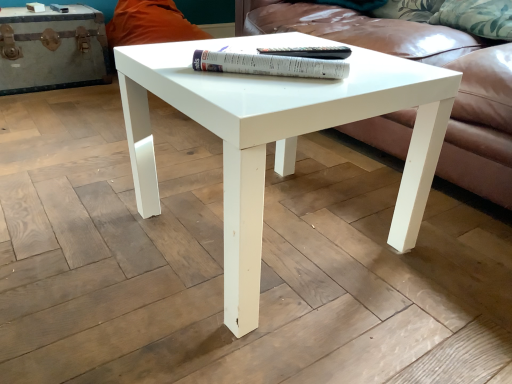
The width and height of the screenshot is (512, 384). Find the location of `white paper at center, the second paperback book when ordered from back to front`. white paper at center, the second paperback book when ordered from back to front is located at coordinates (269, 64).

Describe the element at coordinates (277, 135) in the screenshot. I see `white glossy coffee table at center` at that location.

Looking at this image, how much space does paperback book at center, placed as the 2th paperback book when sorted from front to back, occupy horizontally?

8.45 inches.

Where is `white paper at center, the second paperback book when ordered from back to front`? white paper at center, the second paperback book when ordered from back to front is located at coordinates (269, 64).

In the scene shown: From the image's perspective, is white glossy coffee table at center above or below white paper at center, which ranks as the 1th paperback book in front-to-back order?

white glossy coffee table at center is situated lower than white paper at center, which ranks as the 1th paperback book in front-to-back order, in the image.

The height and width of the screenshot is (384, 512). I want to click on coffee table lying on the left of white paper at center, which ranks as the 1th paperback book in front-to-back order, so click(277, 135).

Does white glossy coffee table at center appear on the left side of white paper at center, which ranks as the 1th paperback book in front-to-back order?

Indeed, white glossy coffee table at center is positioned on the left side of white paper at center, which ranks as the 1th paperback book in front-to-back order.

Considering the sizes of objects white paper at center, which ranks as the 1th paperback book in front-to-back order, and paperback book at center, placed as the 2th paperback book when sorted from front to back, in the image provided, who is taller, white paper at center, which ranks as the 1th paperback book in front-to-back order, or paperback book at center, placed as the 2th paperback book when sorted from front to back,?

white paper at center, which ranks as the 1th paperback book in front-to-back order.

From a real-world perspective, who is located lower, white paper at center, the second paperback book when ordered from back to front, or paperback book at center, placed as the 2th paperback book when sorted from front to back?

In real-world perspective, paperback book at center, placed as the 2th paperback book when sorted from front to back, is lower.

Are white paper at center, which ranks as the 1th paperback book in front-to-back order, and paperback book at center, placed as the 2th paperback book when sorted from front to back, far apart?

white paper at center, which ranks as the 1th paperback book in front-to-back order, is near paperback book at center, placed as the 2th paperback book when sorted from front to back, not far away.

Which is behind, white paper at center, the second paperback book when ordered from back to front, or white leather chest at left?

white leather chest at left is further away from the camera.

Is white paper at center, which ranks as the 1th paperback book in front-to-back order, not within white leather chest at left?

Yes, white paper at center, which ranks as the 1th paperback book in front-to-back order, is not within white leather chest at left.

From the image's perspective, which is below, white paper at center, which ranks as the 1th paperback book in front-to-back order, or white leather chest at left?

white paper at center, which ranks as the 1th paperback book in front-to-back order, from the image's perspective.

Considering the sizes of objects white paper at center, the second paperback book when ordered from back to front, and white leather chest at left in the image provided, who is shorter, white paper at center, the second paperback book when ordered from back to front, or white leather chest at left?

white paper at center, the second paperback book when ordered from back to front, is shorter.

Is white paper at center, which ranks as the 1th paperback book in front-to-back order, not near leather couch at center?

No, white paper at center, which ranks as the 1th paperback book in front-to-back order, is in close proximity to leather couch at center.

From a real-world perspective, who is located higher, white paper at center, which ranks as the 1th paperback book in front-to-back order, or leather couch at center?

From a 3D spatial view, white paper at center, which ranks as the 1th paperback book in front-to-back order, is above.

Looking at this image, is white paper at center, which ranks as the 1th paperback book in front-to-back order, bigger or smaller than leather couch at center?

Considering their sizes, white paper at center, which ranks as the 1th paperback book in front-to-back order, takes up less space than leather couch at center.

Which object is thinner, white paper at center, the second paperback book when ordered from back to front, or leather couch at center?

white paper at center, the second paperback book when ordered from back to front.

Can you confirm if leather couch at center is smaller than white leather chest at left?

Actually, leather couch at center might be larger than white leather chest at left.

Is leather couch at center positioned beyond the bounds of white leather chest at left?

Absolutely, leather couch at center is external to white leather chest at left.

From a real-world perspective, which object stands above the other?

leather couch at center, from a real-world perspective.

Can you tell me how much leather couch at center and white glossy coffee table at center differ in facing direction?

The angular difference between leather couch at center and white glossy coffee table at center is 88.9 degrees.

Is leather couch at center at the left side of white glossy coffee table at center?

Incorrect, leather couch at center is not on the left side of white glossy coffee table at center.

From a real-world perspective, who is located higher, leather couch at center or white glossy coffee table at center?

leather couch at center.

Is white leather chest at left facing towards paperback book at center, placed as the 2th paperback book when sorted from front to back?

Yes, white leather chest at left is oriented towards paperback book at center, placed as the 2th paperback book when sorted from front to back.

From the picture: Is white leather chest at left positioned beyond the bounds of paperback book at center, placed as the 2th paperback book when sorted from front to back?

Yes, white leather chest at left is not within paperback book at center, placed as the 2th paperback book when sorted from front to back.

From a real-world perspective, which object rests below the other?

white leather chest at left, from a real-world perspective.

Considering the sizes of objects white leather chest at left and paperback book at center, which ranks as the first paperback book in back-to-front order, in the image provided, who is shorter, white leather chest at left or paperback book at center, which ranks as the first paperback book in back-to-front order,?

Standing shorter between the two is paperback book at center, which ranks as the first paperback book in back-to-front order.

At what (x,y) coordinates should I click in order to perform the action: click on coffee table on the left side of white paper at center, the second paperback book when ordered from back to front. Please return your answer as a coordinate pair (x, y). This screenshot has height=384, width=512. Looking at the image, I should click on (277, 135).

At what (x,y) coordinates should I click in order to perform the action: click on paperback book below the paperback book at center, placed as the 2th paperback book when sorted from front to back (from the image's perspective). Please return your answer as a coordinate pair (x, y). Looking at the image, I should click on (269, 64).

Considering their positions, is white leather chest at left positioned further to leather couch at center than white paper at center, the second paperback book when ordered from back to front?

white leather chest at left lies further to leather couch at center than the other object.

Estimate the real-world distances between objects in this image. Which object is closer to white glossy coffee table at center, paperback book at center, placed as the 2th paperback book when sorted from front to back, or white leather chest at left?

The object closer to white glossy coffee table at center is paperback book at center, placed as the 2th paperback book when sorted from front to back.

Consider the image. Based on their spatial positions, is white glossy coffee table at center or leather couch at center closer to white paper at center, which ranks as the 1th paperback book in front-to-back order?

white glossy coffee table at center is positioned closer to the anchor white paper at center, which ranks as the 1th paperback book in front-to-back order.

Considering their positions, is white paper at center, which ranks as the 1th paperback book in front-to-back order, positioned further to paperback book at center, which ranks as the first paperback book in back-to-front order, than leather couch at center?

leather couch at center is further to paperback book at center, which ranks as the first paperback book in back-to-front order.

Estimate the real-world distances between objects in this image. Which object is further from leather couch at center, paperback book at center, placed as the 2th paperback book when sorted from front to back, or white glossy coffee table at center?

paperback book at center, placed as the 2th paperback book when sorted from front to back, is positioned further to the anchor leather couch at center.

From the image, which object appears to be farther from leather couch at center, white glossy coffee table at center or paperback book at center, which ranks as the first paperback book in back-to-front order?

paperback book at center, which ranks as the first paperback book in back-to-front order, is positioned further to the anchor leather couch at center.

Estimate the real-world distances between objects in this image. Which object is further from paperback book at center, which ranks as the first paperback book in back-to-front order, white leather chest at left or white paper at center, the second paperback book when ordered from back to front?

Among the two, white leather chest at left is located further to paperback book at center, which ranks as the first paperback book in back-to-front order.

Looking at this image, based on their spatial positions, is white glossy coffee table at center or white paper at center, the second paperback book when ordered from back to front, closer to white leather chest at left?

white glossy coffee table at center is closer to white leather chest at left.

Locate an element on the screen. coffee table located between white leather chest at left and paperback book at center, which ranks as the first paperback book in back-to-front order, in the left-right direction is located at coordinates (277, 135).

At what (x,y) coordinates should I click in order to perform the action: click on paperback book between white paper at center, the second paperback book when ordered from back to front, and leather couch at center from left to right. Please return your answer as a coordinate pair (x, y). The image size is (512, 384). Looking at the image, I should click on (309, 52).

Locate an element on the screen. coffee table between white leather chest at left and leather couch at center in the horizontal direction is located at coordinates coord(277,135).

Where is `paperback book positioned between white glossy coffee table at center and paperback book at center, which ranks as the first paperback book in back-to-front order, from near to far`? This screenshot has height=384, width=512. paperback book positioned between white glossy coffee table at center and paperback book at center, which ranks as the first paperback book in back-to-front order, from near to far is located at coordinates (269, 64).